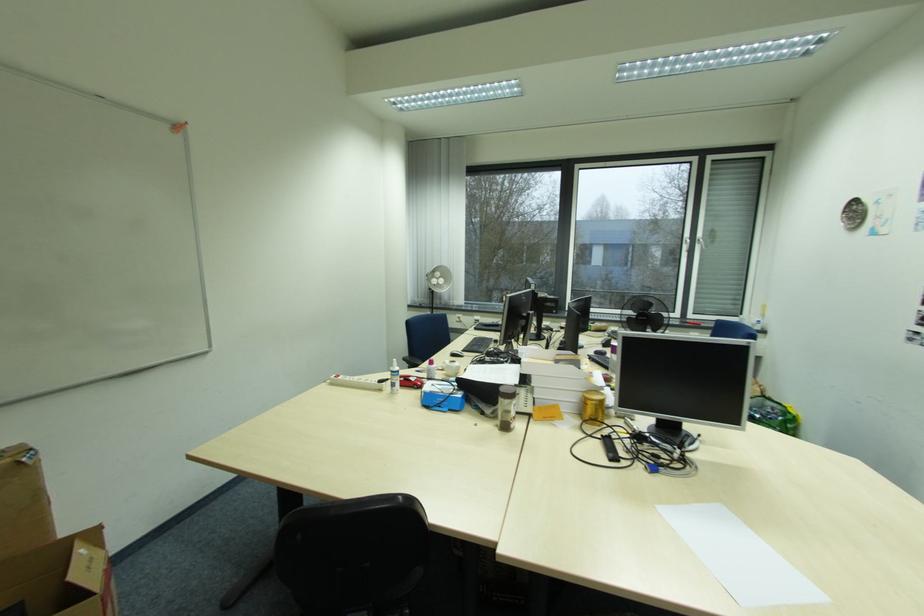
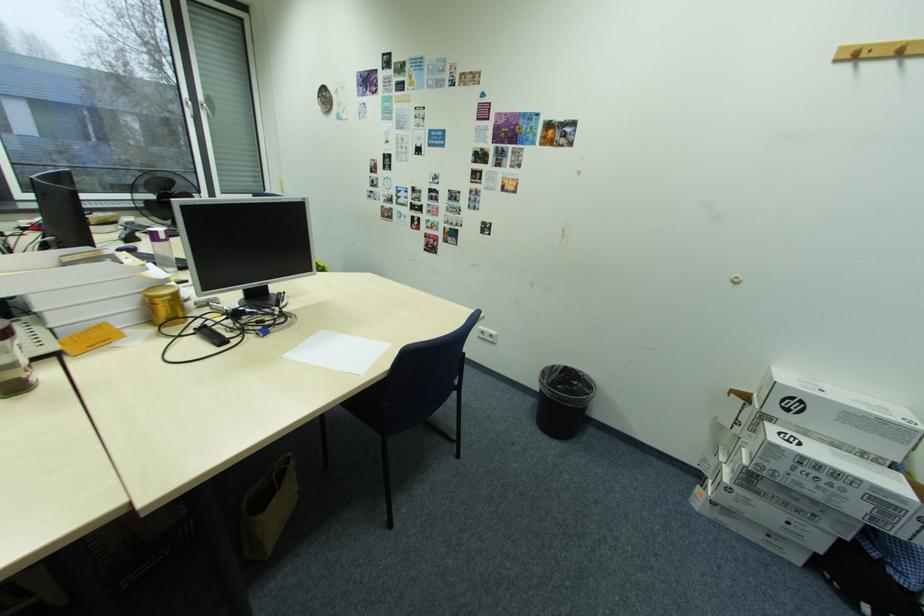
The images are taken continuously from a first-person perspective. In which direction is your viewpoint rotating?

The camera's rotation is toward right-down.